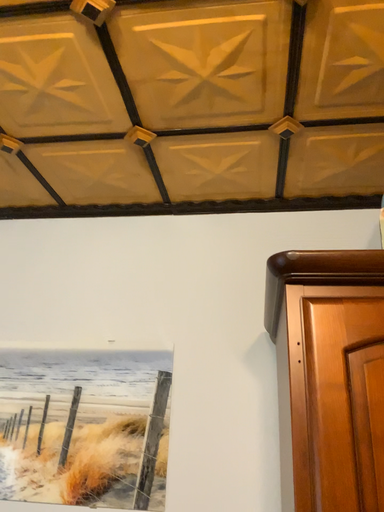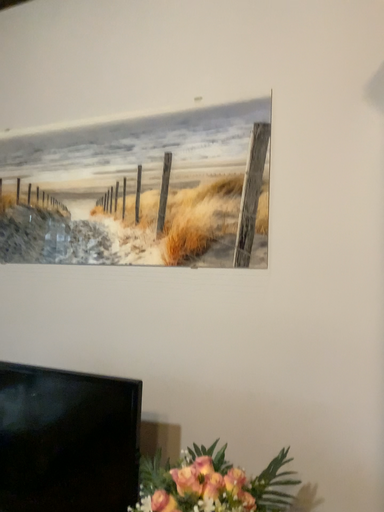
Question: How did the camera likely rotate when shooting the video?

Choices:
 (A) rotated left
 (B) rotated right

Answer: (A)